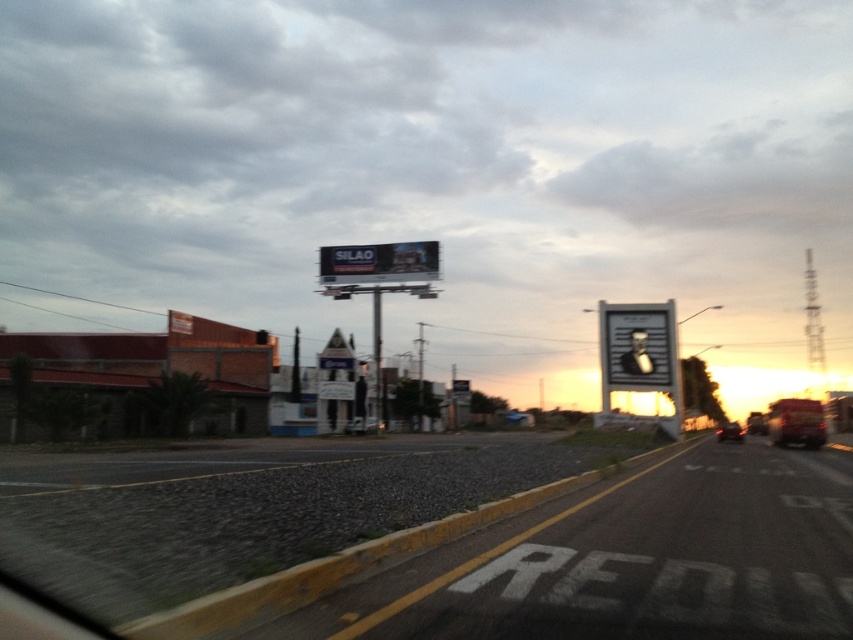
Question: In this image, where is matte black portrait at center located relative to shiny black car at center?

Choices:
 (A) left
 (B) right

Answer: (A)

Question: Can you confirm if matte black portrait at center is positioned below metallic red truck at right?

Choices:
 (A) no
 (B) yes

Answer: (A)

Question: Which point is farther to the camera?

Choices:
 (A) brown brick building at left
 (B) matte black portrait at center
 (C) metallic silver portrait at right

Answer: (B)

Question: Is metallic silver billboard at center further to the viewer compared to metallic red truck at right?

Choices:
 (A) no
 (B) yes

Answer: (B)

Question: Among these objects, which one is nearest to the camera?

Choices:
 (A) metallic silver billboard at center
 (B) metallic silver portrait at right
 (C) shiny black car at center

Answer: (B)

Question: Which of the following is the farthest from the observer?

Choices:
 (A) (643, 378)
 (B) (431, 268)

Answer: (B)